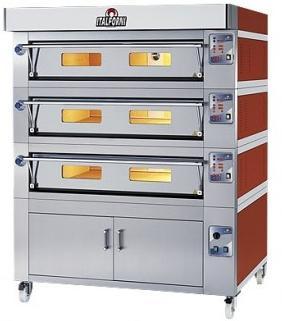
Image resolution: width=282 pixels, height=321 pixels. I want to click on doors, so click(x=195, y=181), click(x=185, y=113), click(x=186, y=69), click(x=78, y=255), click(x=146, y=252).